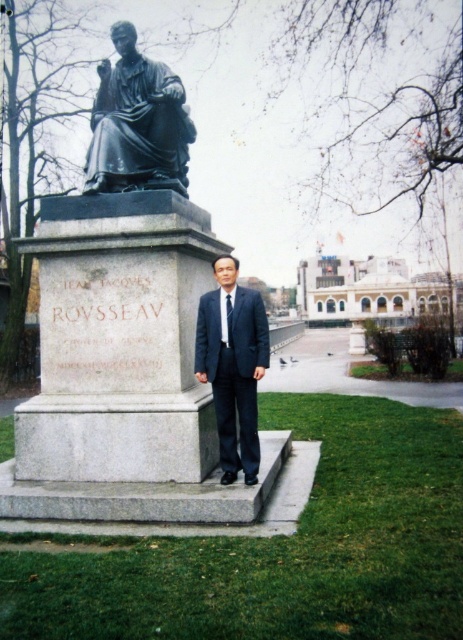
Question: Is bronze statue at center positioned before blue silk tie at center?

Choices:
 (A) yes
 (B) no

Answer: (B)

Question: Which object is closer to the camera taking this photo?

Choices:
 (A) bronze statue at center
 (B) blue silk tie at center
 (C) dark blue suit at center

Answer: (C)

Question: Based on their relative distances, which object is nearer to the bronze statue at center?

Choices:
 (A) blue silk tie at center
 (B) dark blue suit at center

Answer: (B)

Question: Which point appears closest to the camera in this image?

Choices:
 (A) (173, 108)
 (B) (237, 381)
 (C) (227, 300)

Answer: (B)

Question: Considering the relative positions of bronze statue at center and dark blue suit at center in the image provided, where is bronze statue at center located with respect to dark blue suit at center?

Choices:
 (A) below
 (B) above

Answer: (B)

Question: Can you confirm if dark blue suit at center is wider than blue silk tie at center?

Choices:
 (A) yes
 (B) no

Answer: (A)